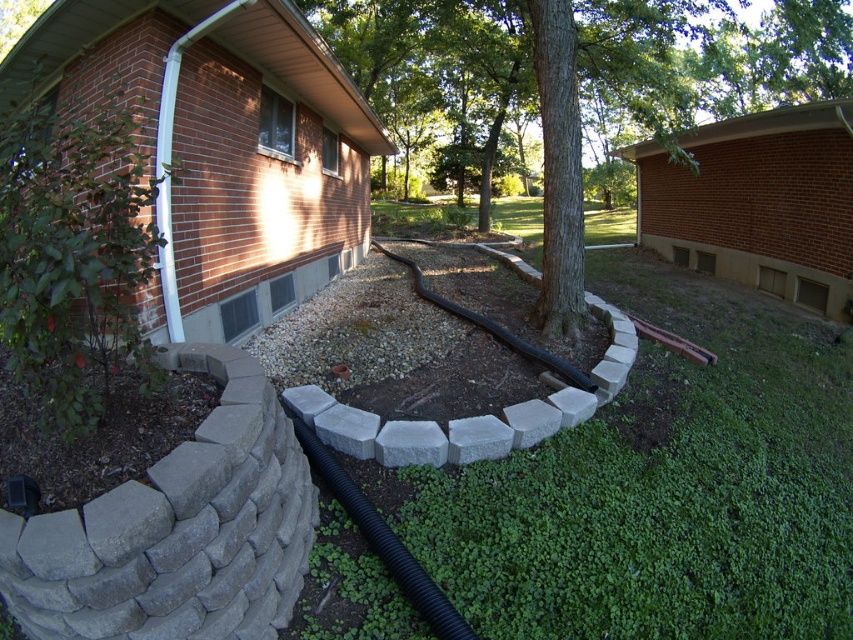
Question: Among these objects, which one is farthest from the camera?

Choices:
 (A) black rubber garden hose at center
 (B) black rubber hose at center
 (C) green textured tree at center

Answer: (C)

Question: Does gray stone flower bed at lower left appear on the left side of black rubber garden hose at center?

Choices:
 (A) no
 (B) yes

Answer: (B)

Question: Estimate the real-world distances between objects in this image. Which object is farther from the gray stone flower bed at lower left?

Choices:
 (A) black rubber hose at center
 (B) green textured tree at center
 (C) black rubber garden hose at center

Answer: (B)

Question: Does gray stone flower bed at lower left appear under black rubber garden hose at center?

Choices:
 (A) no
 (B) yes

Answer: (B)

Question: Is black rubber hose at center above black rubber garden hose at center?

Choices:
 (A) yes
 (B) no

Answer: (B)

Question: Based on their relative distances, which object is nearer to the black rubber hose at center?

Choices:
 (A) gray stone flower bed at lower left
 (B) black rubber garden hose at center

Answer: (A)